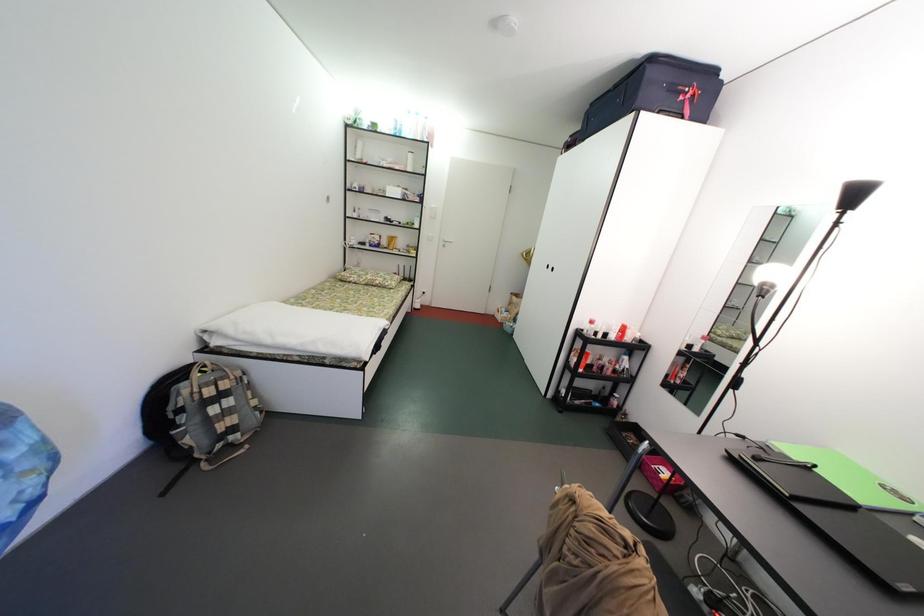
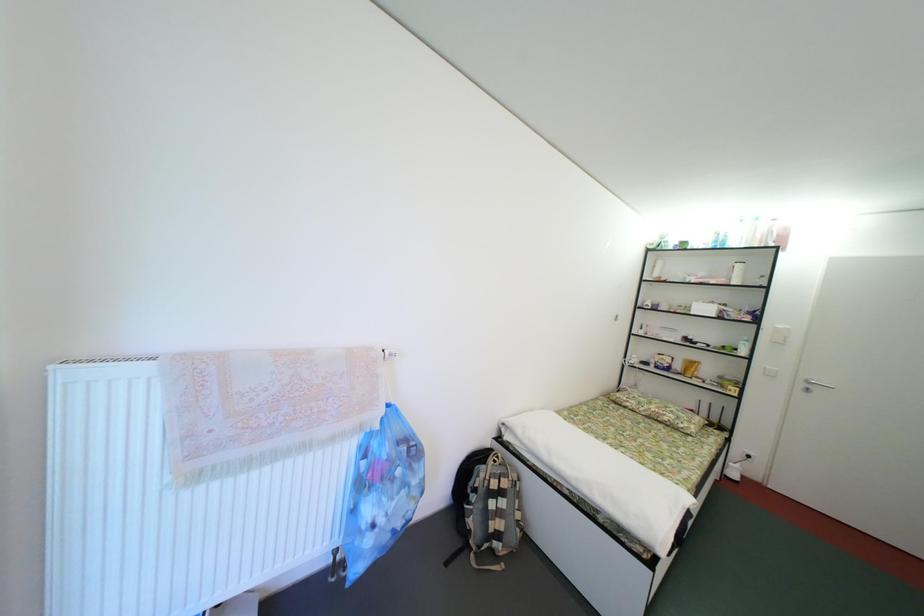
Question: How did the camera likely rotate?

Choices:
 (A) Left
 (B) Right
 (C) Up
 (D) Down

Answer: (A)